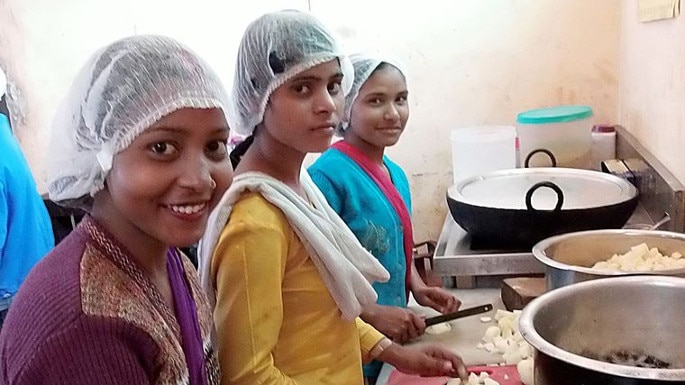
At what (x,y) coordinates should I click in order to perform the action: click on cutting board. Please return your answer as a coordinate pair (x, y). The image size is (685, 385). Looking at the image, I should click on [x=418, y=378].